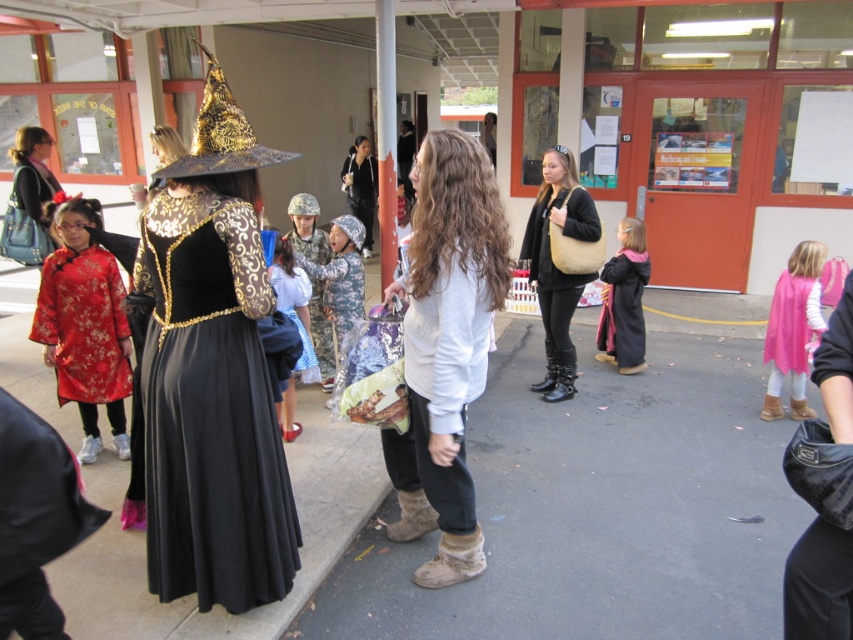
Who is positioned more to the left, matte black jacket at center or matte black jacket at upper left?

matte black jacket at upper left is more to the left.

Is matte black jacket at center bigger than matte black jacket at upper left?

Yes.

Which is behind, point (521, 262) or point (39, 148)?

Positioned behind is point (39, 148).

Where is `matte black jacket at center`? matte black jacket at center is located at coordinates (555, 266).

Who is shorter, velvet/golden/black dress at center or camouflage fabric robe at center?

camouflage fabric robe at center is shorter.

Who is positioned more to the left, velvet/golden/black dress at center or camouflage fabric robe at center?

From the viewer's perspective, velvet/golden/black dress at center appears more on the left side.

Between point (223, 339) and point (312, 301), which one is positioned behind?

Point (312, 301)

Locate an element on the screen. velvet/golden/black dress at center is located at coordinates (210, 406).

Who is more forward, (99, 348) or (546, 378)?

Positioned in front is point (99, 348).

Is shiny red dress at left further to camera compared to matte black jacket at center?

No, it is in front of matte black jacket at center.

The height and width of the screenshot is (640, 853). Find the location of `shiny red dress at left`. shiny red dress at left is located at coordinates (84, 324).